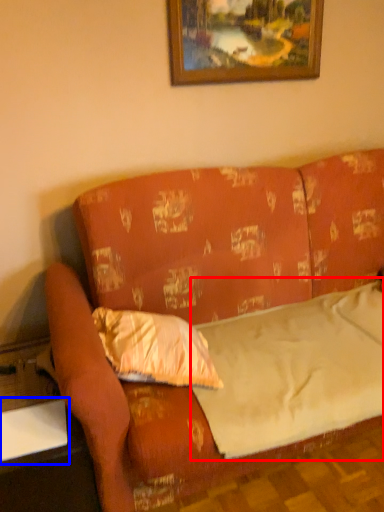
Question: Which of the following is the closest to the observer, sheet (highlighted by a red box) or table (highlighted by a blue box)?

Choices:
 (A) sheet
 (B) table

Answer: (A)